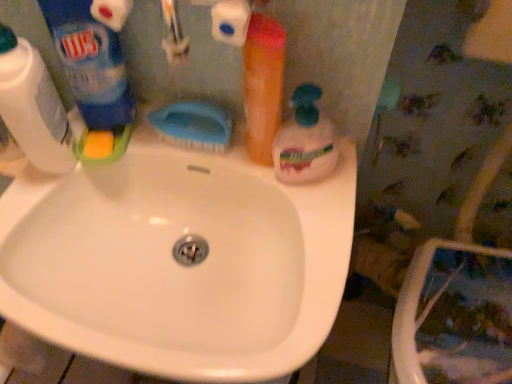
Question: Is translucent orange bottle at upper right, the second cleaning product in the right-to-left sequence, bigger than white plastic bottle at left, which is the first cleaning product in left-to-right order?

Choices:
 (A) yes
 (B) no

Answer: (B)

Question: Considering the relative positions of translucent orange bottle at upper right, marked as the 3th cleaning product in a left-to-right arrangement, and white plastic bottle at left, which is the first cleaning product in left-to-right order, in the image provided, is translucent orange bottle at upper right, marked as the 3th cleaning product in a left-to-right arrangement, to the left of white plastic bottle at left, which is the first cleaning product in left-to-right order, from the viewer's perspective?

Choices:
 (A) no
 (B) yes

Answer: (A)

Question: Can white plastic bottle at left, positioned as the 4th cleaning product in right-to-left order, be found inside translucent orange bottle at upper right, the second cleaning product in the right-to-left sequence?

Choices:
 (A) no
 (B) yes

Answer: (A)

Question: Would you say translucent orange bottle at upper right, marked as the 3th cleaning product in a left-to-right arrangement, is outside white plastic bottle at left, positioned as the 4th cleaning product in right-to-left order?

Choices:
 (A) yes
 (B) no

Answer: (A)

Question: Is translucent orange bottle at upper right, marked as the 3th cleaning product in a left-to-right arrangement, far away from white plastic bottle at left, which is the first cleaning product in left-to-right order?

Choices:
 (A) yes
 (B) no

Answer: (B)

Question: In the image, is blue plastic brush at center positioned in front of or behind white glossy sink at center?

Choices:
 (A) behind
 (B) front

Answer: (A)

Question: Considering the positions of point (160, 122) and point (160, 319), is point (160, 122) closer or farther from the camera than point (160, 319)?

Choices:
 (A) closer
 (B) farther

Answer: (B)

Question: Is blue plastic brush at center wider or thinner than white glossy sink at center?

Choices:
 (A) wide
 (B) thin

Answer: (B)

Question: From the image's perspective, is blue plastic brush at center above or below white glossy sink at center?

Choices:
 (A) above
 (B) below

Answer: (A)

Question: Is blue plastic brush at center to the left or to the right of white plastic bottle at left, which is the first cleaning product in left-to-right order, in the image?

Choices:
 (A) left
 (B) right

Answer: (B)

Question: From the image's perspective, is blue plastic brush at center above or below white plastic bottle at left, positioned as the 4th cleaning product in right-to-left order?

Choices:
 (A) below
 (B) above

Answer: (A)

Question: Is blue plastic brush at center bigger or smaller than white plastic bottle at left, which is the first cleaning product in left-to-right order?

Choices:
 (A) big
 (B) small

Answer: (B)

Question: From their relative heights in the image, would you say blue plastic brush at center is taller or shorter than white plastic bottle at left, positioned as the 4th cleaning product in right-to-left order?

Choices:
 (A) short
 (B) tall

Answer: (A)

Question: Considering their positions, is blue plastic brush at center located in front of or behind blue plastic bottle at upper left, the 2th cleaning product in the left-to-right sequence?

Choices:
 (A) front
 (B) behind

Answer: (B)

Question: From a real-world perspective, relative to blue plastic bottle at upper left, the 2th cleaning product in the left-to-right sequence, is blue plastic brush at center vertically above or below?

Choices:
 (A) below
 (B) above

Answer: (A)